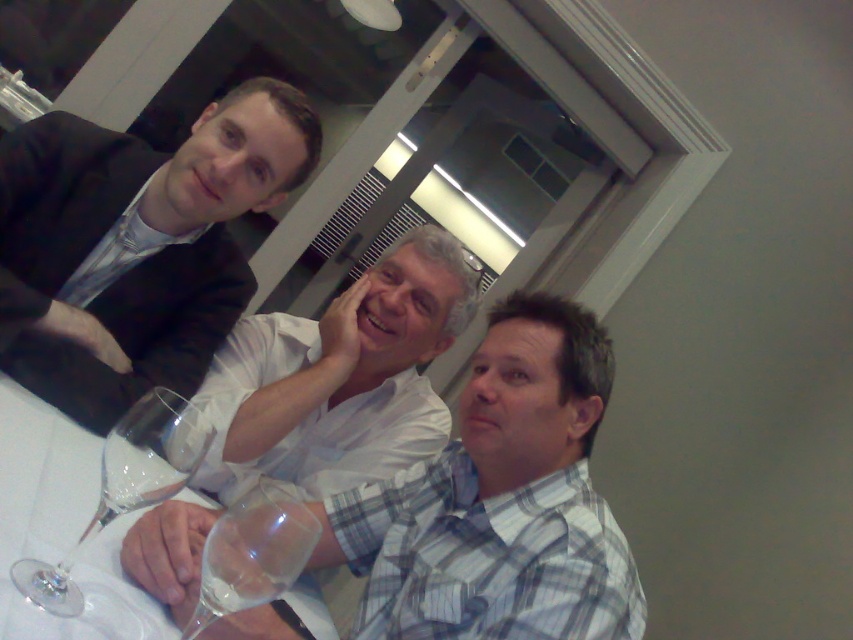
Who is lower down, transparent glass wine glass at lower left or transparent glass wine glass at lower center?

transparent glass wine glass at lower center

Which is above, transparent glass wine glass at lower left or transparent glass wine glass at lower center?

Positioned higher is transparent glass wine glass at lower left.

Is point (149, 493) closer to camera compared to point (260, 545)?

No, (149, 493) is further to viewer.

Identify the location of transparent glass wine glass at lower left. (125, 484).

Can you confirm if white cotton shirt at center is positioned to the right of transparent glass at lower center?

Yes, white cotton shirt at center is to the right of transparent glass at lower center.

From the picture: Can you confirm if white cotton shirt at center is shorter than transparent glass at lower center?

No.

Who is more distant from viewer, (514, 458) or (212, 593)?

The point (514, 458) is more distant.

Locate an element on the screen. The image size is (853, 640). white cotton shirt at center is located at coordinates (498, 500).

Does transparent glass wine glass at lower center have a lesser height compared to transparent glass at lower center?

No.

Between transparent glass wine glass at lower center and transparent glass at lower center, which one appears on the left side from the viewer's perspective?

From the viewer's perspective, transparent glass wine glass at lower center appears more on the left side.

This screenshot has height=640, width=853. Find the location of `transparent glass wine glass at lower center`. transparent glass wine glass at lower center is located at coordinates (252, 554).